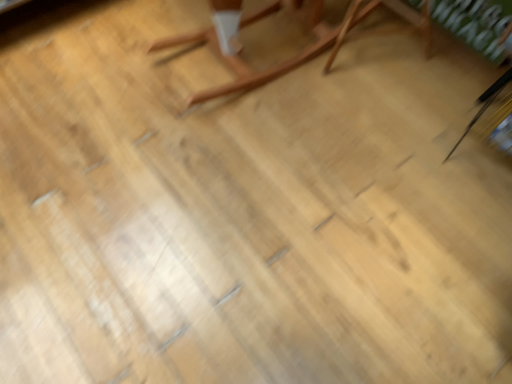
Where is `free point below light brown wood rocking chair at center (from a real-world perspective)`? free point below light brown wood rocking chair at center (from a real-world perspective) is located at coordinates (246, 53).